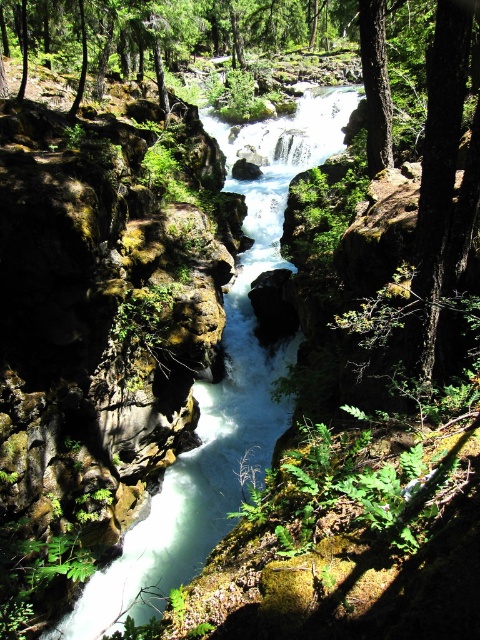
Which is behind, point (216, 413) or point (379, 32)?

The point (216, 413) is behind.

Describe the element at coordinates (220, 385) in the screenshot. I see `white smooth stream at center` at that location.

Image resolution: width=480 pixels, height=640 pixels. Identify the location of white smooth stream at center. (220, 385).